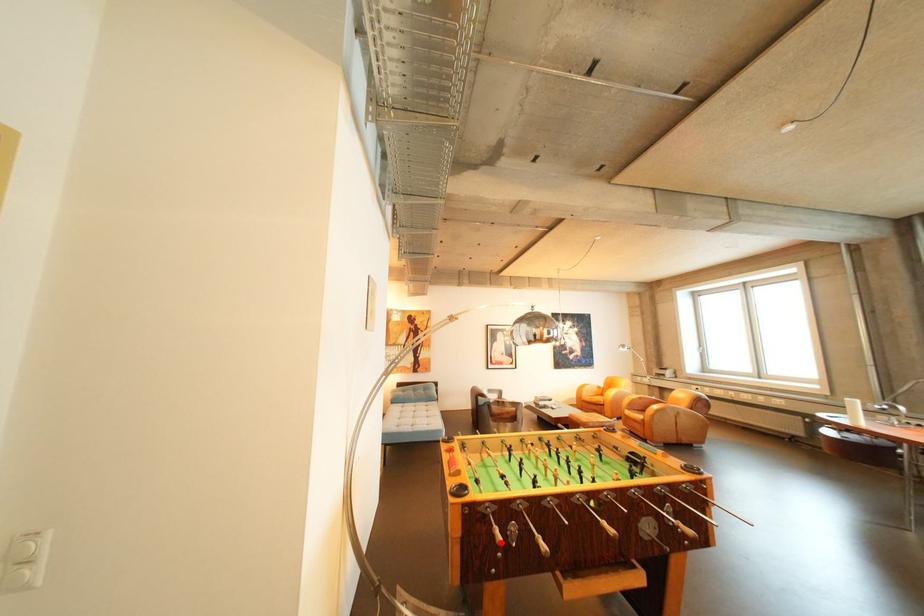
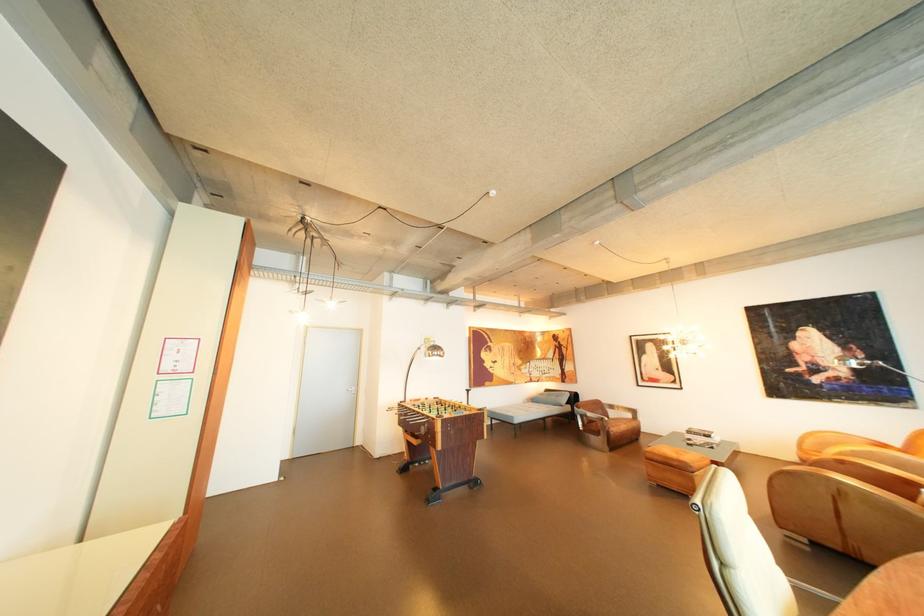
Question: I am providing you with two images of the same scene from different viewpoints. A red point is marked on the first image. Can you still see the location of the red point in image 2?

Choices:
 (A) Yes
 (B) No

Answer: (B)